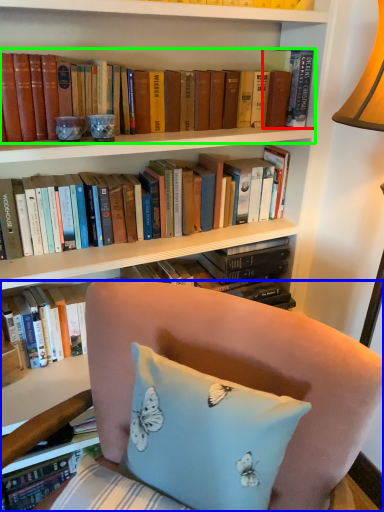
Question: Based on their relative distances, which object is farther from book (highlighted by a red box)? Choose from chair (highlighted by a blue box) and book (highlighted by a green box).

Choices:
 (A) chair
 (B) book

Answer: (A)